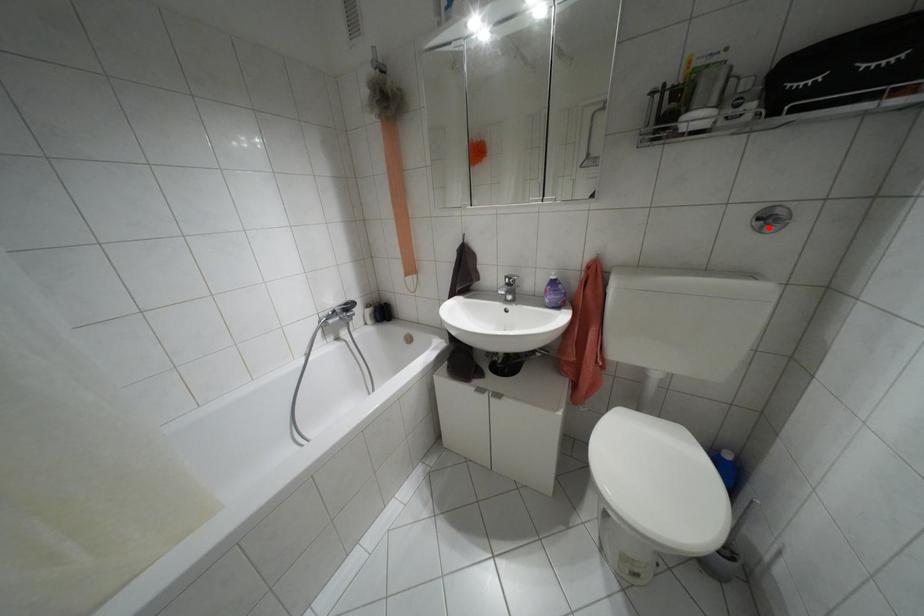
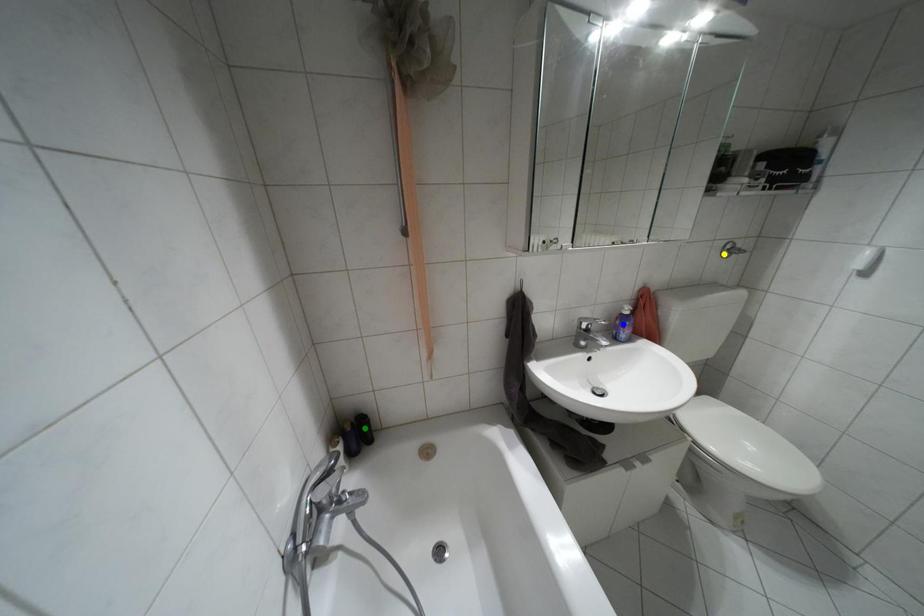
Question: I am providing you with two images of the same scene from different viewpoints. A red point is marked on the first image. You are given multiple points on the second image. Which mark in image 2 goes with the point in image 1?

Choices:
 (A) green point
 (B) blue point
 (C) yellow point

Answer: (C)